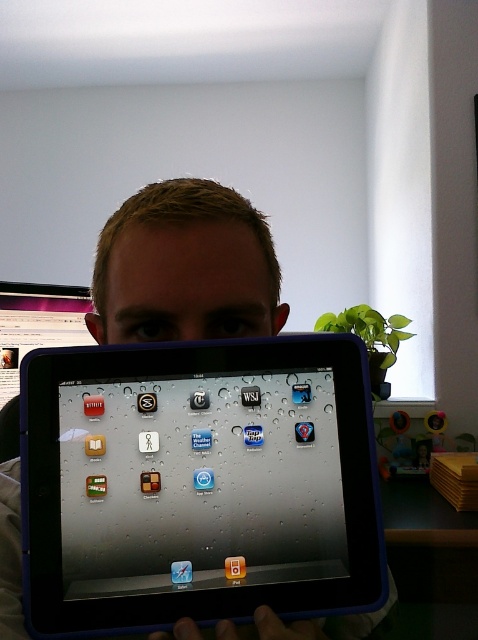
Question: Which of the following is the closest to the observer?

Choices:
 (A) matte skin at center
 (B) satin black tablet at center

Answer: (B)

Question: Can you confirm if satin black tablet at center is bigger than matte skin at center?

Choices:
 (A) no
 (B) yes

Answer: (B)

Question: Is satin black tablet at center wider than matte skin at center?

Choices:
 (A) yes
 (B) no

Answer: (A)

Question: Which of the following is the closest to the observer?

Choices:
 (A) satin black tablet at center
 (B) matte skin at center

Answer: (A)

Question: Does satin black tablet at center appear on the right side of matte skin at center?

Choices:
 (A) yes
 (B) no

Answer: (A)